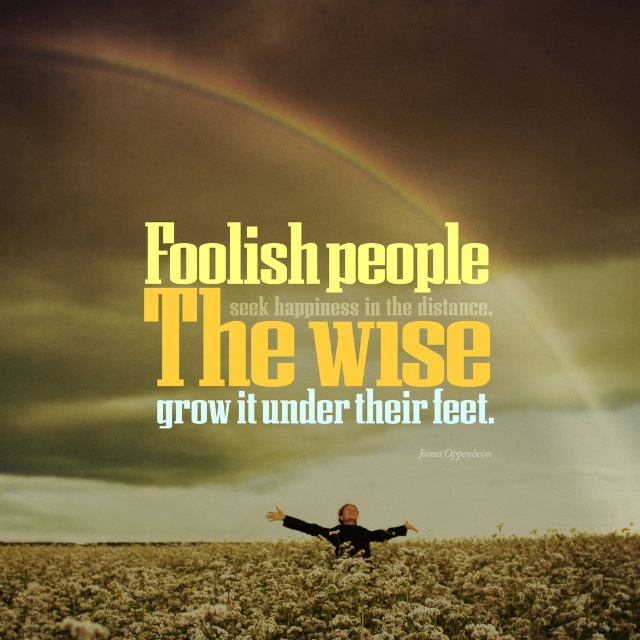
You are an artist trying to paint the scene. You notice two arms in the image, the smooth black arm at center and the black matte arm at lower center. Which arm should you paint higher up in your painting to accurately represent their positions?

The smooth black arm at center should be painted higher up in the painting because it is taller than the black matte arm at lower center.

You are a photographer standing in the scene wanting to capture the white fluffy flowers at lower center and the black matte arm at lower center. Which object would appear larger in your photo if you focus on the closer one?

The white fluffy flowers at lower center would appear larger in the photo since they are closer to the viewer compared to the black matte arm at lower center.

You are a photographer standing in the field of white flowers. You want to capture a photo that includes both the golden hair person at center and the black matte arm at lower center without any part of them being cut off. What is the minimum distance you should keep between the camera and the two objects?

The golden hair person at center and the black matte arm at lower center are 24.82 inches apart. To ensure both are fully visible in the photo, the camera should be positioned at least 24.82 inches away from the closer object.